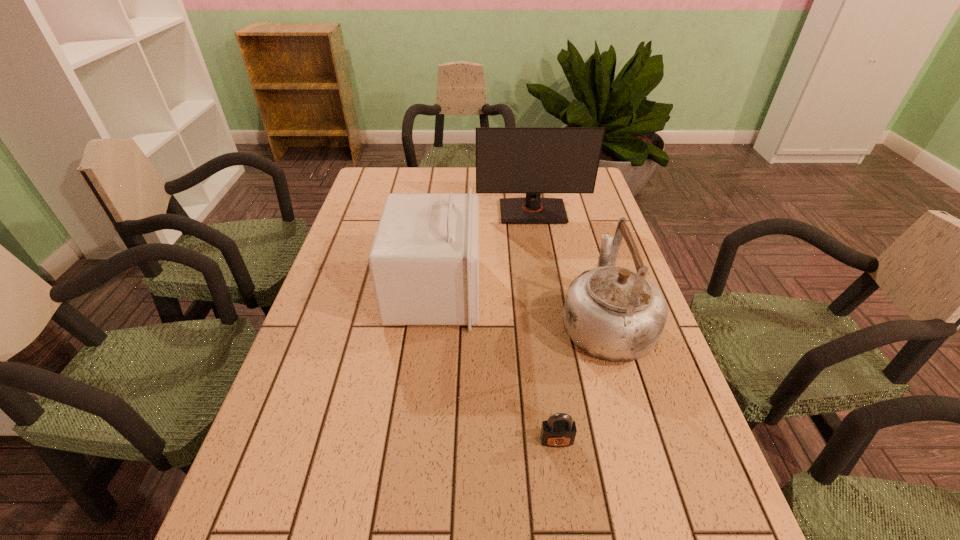
In order to click on unoccupied area between the farthest object and the padlock in this screenshot , I will do `click(544, 326)`.

I want to click on free space between the nearest object and the farthest object, so click(544, 326).

Image resolution: width=960 pixels, height=540 pixels. What are the coordinates of `free area in between the kettle and the padlock` in the screenshot? It's located at (581, 381).

The image size is (960, 540). Identify the location of vacant space that's between the kettle and the first-aid kit. (520, 307).

Where is `unoccupied area between the first-aid kit and the kettle`? Image resolution: width=960 pixels, height=540 pixels. unoccupied area between the first-aid kit and the kettle is located at coordinates (520, 307).

Where is `vacant space that's between the kettle and the farthest object`? This screenshot has width=960, height=540. vacant space that's between the kettle and the farthest object is located at coordinates point(569,267).

You are a GUI agent. You are given a task and a screenshot of the screen. Output one action in this format:
    pyautogui.click(x=<x>, y=<y>)
    Task: Click on the free spot between the first-aid kit and the farthest object
    This screenshot has width=960, height=540.
    Given the screenshot: What is the action you would take?
    pyautogui.click(x=484, y=251)

Where is `unoccupied position between the padlock and the monitor`? unoccupied position between the padlock and the monitor is located at coordinates (544, 326).

The width and height of the screenshot is (960, 540). I want to click on vacant area that lies between the nearest object and the first-aid kit, so click(x=495, y=366).

Identify the location of object that is the second nearest to the padlock. The image size is (960, 540). (424, 261).